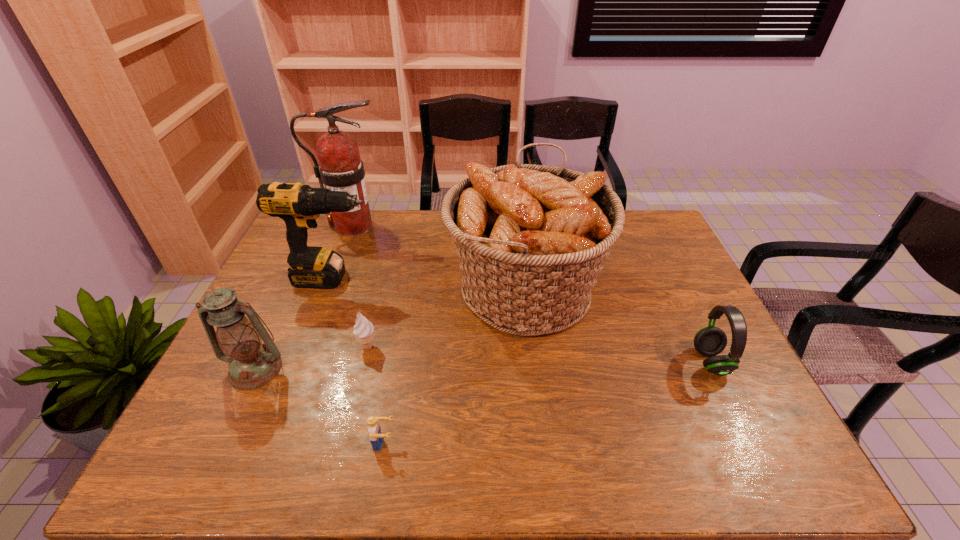
What are the coordinates of `unoccupied area between the drill and the fire extinguisher` in the screenshot? It's located at (343, 252).

You are a GUI agent. You are given a task and a screenshot of the screen. Output one action in this format:
    pyautogui.click(x=<x>, y=<y>)
    Task: Click on the free space between the fifth tallest object and the second shortest object
    
    Given the screenshot: What is the action you would take?
    540,354

Locate an element on the screen. object identified as the sixth closest to the tallest object is located at coordinates (710, 341).

Image resolution: width=960 pixels, height=540 pixels. Find the location of `object that stands as the fourth closest to the shortest object`. object that stands as the fourth closest to the shortest object is located at coordinates (299, 206).

The height and width of the screenshot is (540, 960). Find the location of `free space that satisfies the following two spatial constraints: 1. at the tip of the drill; 2. on the front side of the oil lamp`. free space that satisfies the following two spatial constraints: 1. at the tip of the drill; 2. on the front side of the oil lamp is located at coordinates (299, 369).